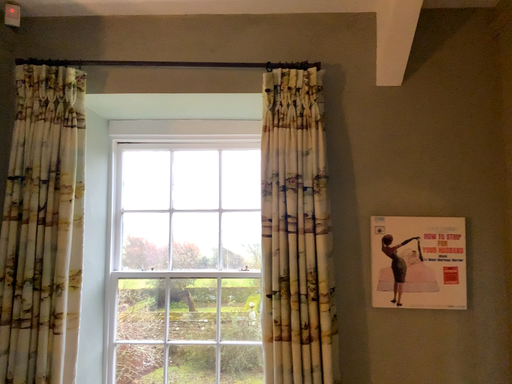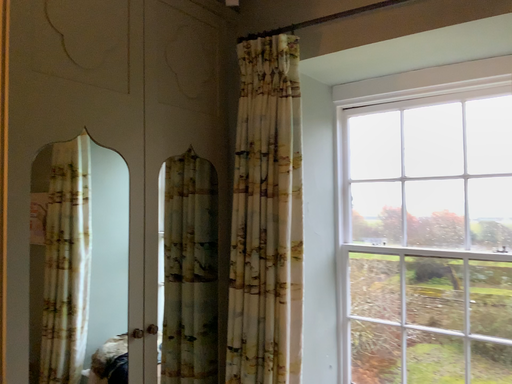
Question: How did the camera likely rotate when shooting the video?

Choices:
 (A) rotated left
 (B) rotated right

Answer: (A)